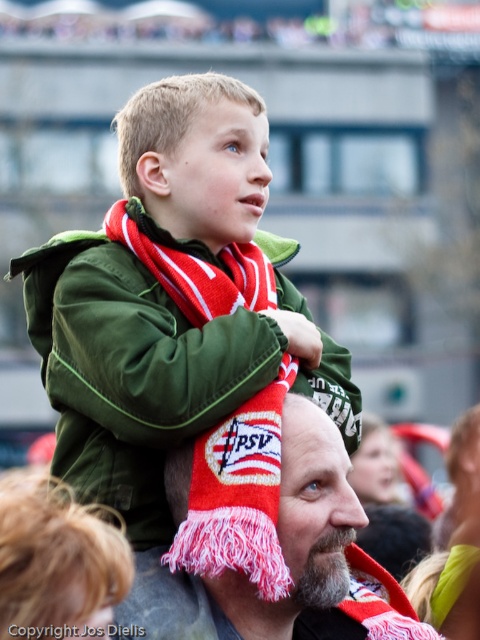
Question: Does red knitted scarf at center come behind knitted scarf at center?

Choices:
 (A) yes
 (B) no

Answer: (A)

Question: Based on their relative distances, which object is farther from the knitted scarf at center?

Choices:
 (A) red/white striped scarf at upper center
 (B) red knitted scarf at center

Answer: (B)

Question: Among these points, which one is nearest to the camera?

Choices:
 (A) (193, 609)
 (B) (273, 353)

Answer: (A)

Question: Which of the following is the closest to the observer?

Choices:
 (A) knitted scarf at center
 (B) red knitted scarf at center

Answer: (A)

Question: Can you confirm if red knitted scarf at center is smaller than knitted scarf at center?

Choices:
 (A) yes
 (B) no

Answer: (B)

Question: From the image, what is the correct spatial relationship of red knitted scarf at center in relation to red/white striped scarf at upper center?

Choices:
 (A) above
 (B) below

Answer: (A)